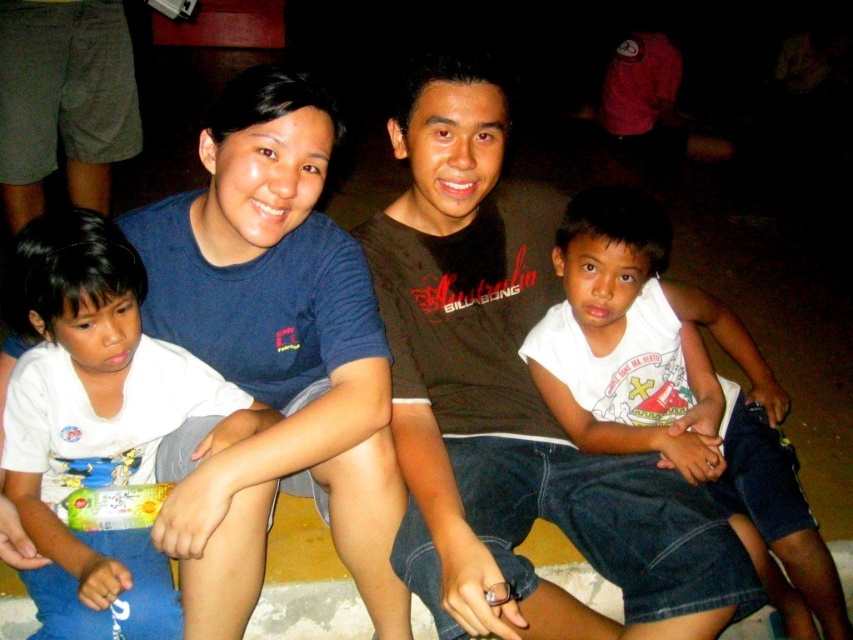
Question: Which point is farther from the camera taking this photo?

Choices:
 (A) (735, 472)
 (B) (488, 198)

Answer: (A)

Question: Considering the relative positions of brown cotton shirt at center and white cotton shirt at lower right in the image provided, where is brown cotton shirt at center located with respect to white cotton shirt at lower right?

Choices:
 (A) below
 (B) above

Answer: (B)

Question: Does brown cotton shirt at center have a greater width compared to white cotton shirt at lower right?

Choices:
 (A) no
 (B) yes

Answer: (A)

Question: Which point is farther to the camera?

Choices:
 (A) white cotton shirt at lower right
 (B) brown cotton shirt at center

Answer: (A)

Question: Estimate the real-world distances between objects in this image. Which object is farther from the brown cotton shirt at center?

Choices:
 (A) white cotton shirt at lower right
 (B) white cotton shirt at left

Answer: (B)

Question: Is white cotton shirt at left wider than white cotton shirt at lower right?

Choices:
 (A) yes
 (B) no

Answer: (B)